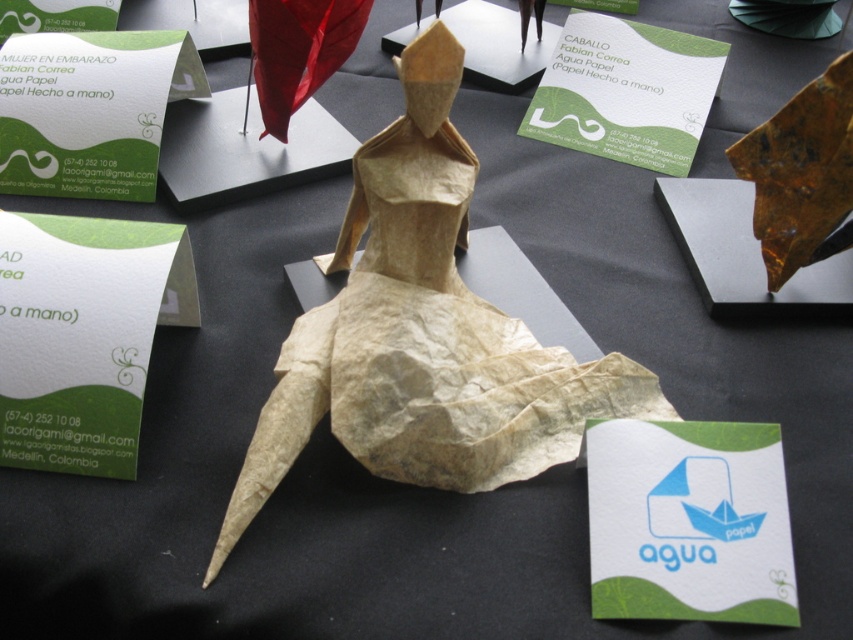
Is point (169, 227) positioned in front of point (129, 120)?

Yes, point (169, 227) is in front of point (129, 120).

Which of these two, white paper at upper left or green paper business card at upper left, stands shorter?

Standing shorter between the two is green paper business card at upper left.

Which is in front, point (165, 225) or point (190, 86)?

Point (165, 225)

Locate an element on the screen. This screenshot has height=640, width=853. white paper at upper left is located at coordinates (83, 336).

Is white paper at upper left in front of white paper boat at center?

No, white paper at upper left is behind white paper boat at center.

Who is lower down, white paper at upper left or white paper boat at center?

white paper boat at center is lower down.

This screenshot has width=853, height=640. I want to click on white paper at upper left, so click(83, 336).

Can you confirm if green paper business card at upper left is bigger than green paper at upper center?

Yes.

Between point (56, 99) and point (722, 65), which one is positioned in front?

Point (56, 99) is in front.

Who is more forward, (85, 148) or (677, 157)?

Point (85, 148)

At what (x,y) coordinates should I click in order to perform the action: click on green paper business card at upper left. Please return your answer as a coordinate pair (x, y). Image resolution: width=853 pixels, height=640 pixels. Looking at the image, I should click on (90, 109).